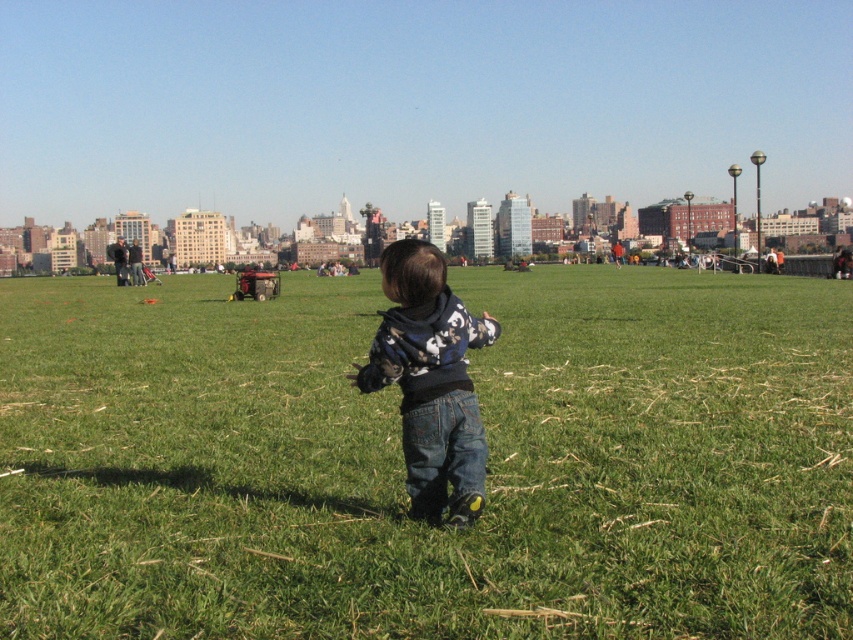
Question: Can you confirm if green grass at center is thinner than denim pants at center?

Choices:
 (A) yes
 (B) no

Answer: (B)

Question: Does green grass at center appear over denim pants at center?

Choices:
 (A) yes
 (B) no

Answer: (B)

Question: Is green grass at center bigger than denim pants at center?

Choices:
 (A) yes
 (B) no

Answer: (A)

Question: Which object is closer to the camera taking this photo?

Choices:
 (A) green grass at center
 (B) denim pants at center

Answer: (A)

Question: Which object appears farthest from the camera in this image?

Choices:
 (A) green grass at center
 (B) denim pants at center

Answer: (B)